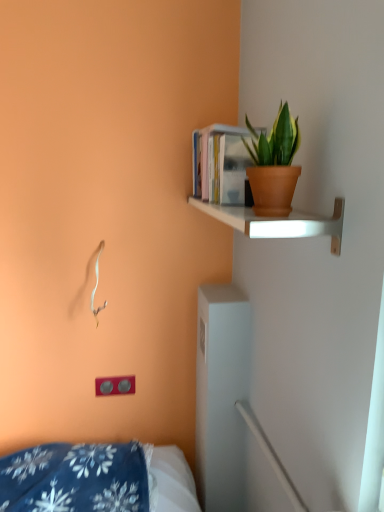
Question: Is matte white shelf at upper right far from hardcover books at upper right?

Choices:
 (A) yes
 (B) no

Answer: (B)

Question: From a real-world perspective, does matte white shelf at upper right sit lower than hardcover books at upper right?

Choices:
 (A) no
 (B) yes

Answer: (B)

Question: Is matte white shelf at upper right shorter than hardcover books at upper right?

Choices:
 (A) yes
 (B) no

Answer: (A)

Question: Is hardcover books at upper right located within matte white shelf at upper right?

Choices:
 (A) yes
 (B) no

Answer: (B)

Question: From a real-world perspective, is matte white shelf at upper right positioned over hardcover books at upper right based on gravity?

Choices:
 (A) no
 (B) yes

Answer: (A)

Question: Based on their sizes in the image, would you say matte white shelf at upper right is bigger or smaller than terracotta pot at upper right?

Choices:
 (A) big
 (B) small

Answer: (A)

Question: Is matte white shelf at upper right wider or thinner than terracotta pot at upper right?

Choices:
 (A) thin
 (B) wide

Answer: (B)

Question: Is matte white shelf at upper right in front of or behind terracotta pot at upper right in the image?

Choices:
 (A) behind
 (B) front

Answer: (B)

Question: Considering the relative positions of matte white shelf at upper right and terracotta pot at upper right in the image provided, is matte white shelf at upper right to the left or to the right of terracotta pot at upper right?

Choices:
 (A) left
 (B) right

Answer: (A)

Question: Is point (97, 393) positioned closer to the camera than point (334, 234)?

Choices:
 (A) closer
 (B) farther

Answer: (B)

Question: Is matte gray electric outlet at lower left wider or thinner than matte white shelf at upper right?

Choices:
 (A) thin
 (B) wide

Answer: (A)

Question: From a real-world perspective, is matte gray electric outlet at lower left positioned above or below matte white shelf at upper right?

Choices:
 (A) above
 (B) below

Answer: (B)

Question: Based on their sizes in the image, would you say matte gray electric outlet at lower left is bigger or smaller than matte white shelf at upper right?

Choices:
 (A) small
 (B) big

Answer: (A)

Question: In terms of width, does hardcover books at upper right look wider or thinner when compared to terracotta pot at upper right?

Choices:
 (A) wide
 (B) thin

Answer: (A)

Question: Would you say hardcover books at upper right is inside or outside terracotta pot at upper right?

Choices:
 (A) inside
 (B) outside

Answer: (B)